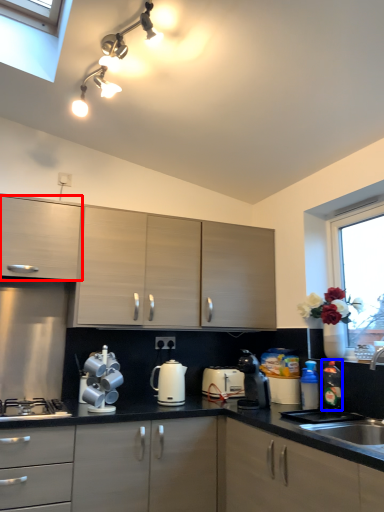
Question: Which object is further to the camera taking this photo, cabinetry (highlighted by a red box) or bottle (highlighted by a blue box)?

Choices:
 (A) cabinetry
 (B) bottle

Answer: (B)